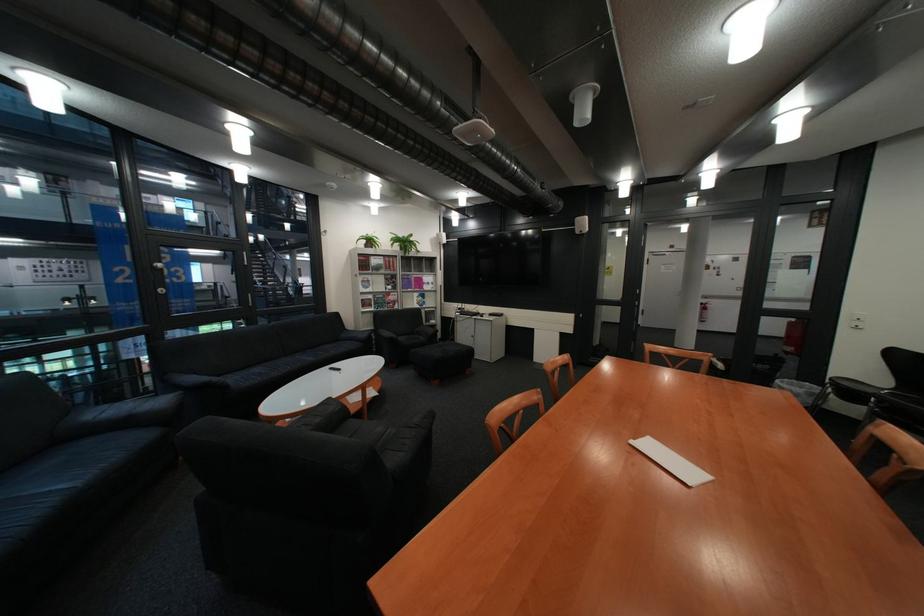
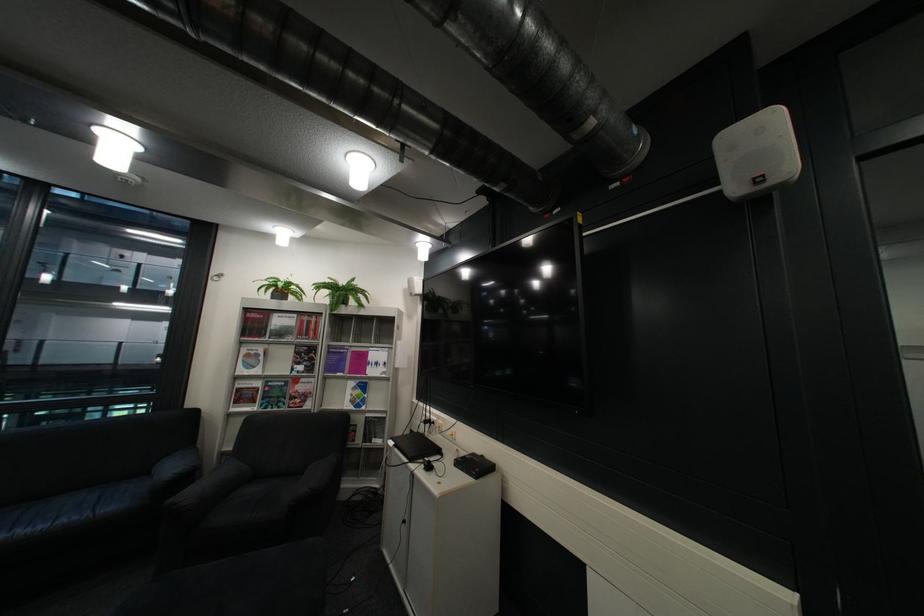
The point at (378, 300) is marked in the first image. Where is the corresponding point in the second image?

(254, 390)